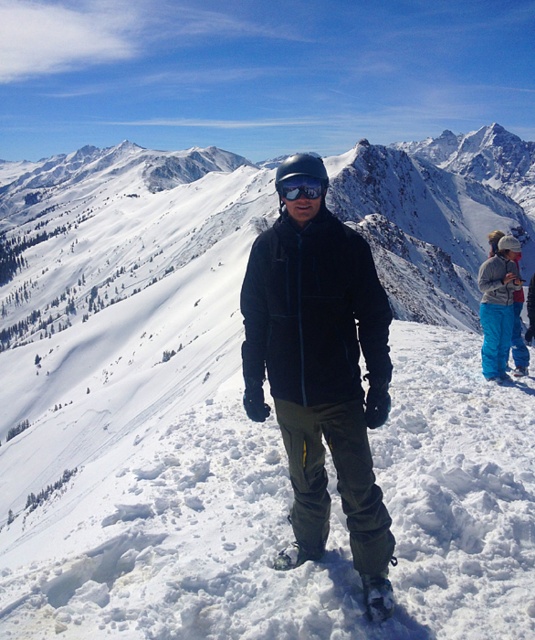
Question: Which point is farther to the camera?

Choices:
 (A) (510, 285)
 (B) (280, 552)

Answer: (A)

Question: Which point is farther to the camera?

Choices:
 (A) black matte goggles at center
 (B) matte blue snow pants at right

Answer: (B)

Question: Based on their relative distances, which object is nearer to the black matte goggles at center?

Choices:
 (A) matte blue snow pants at right
 (B) matte black jacket at center

Answer: (B)

Question: Can you confirm if matte blue snow pants at right is positioned above black matte goggles at center?

Choices:
 (A) no
 (B) yes

Answer: (A)

Question: Is matte black jacket at center behind black matte goggles at center?

Choices:
 (A) no
 (B) yes

Answer: (A)

Question: Is matte black jacket at center to the left of matte blue snow pants at right from the viewer's perspective?

Choices:
 (A) yes
 (B) no

Answer: (A)